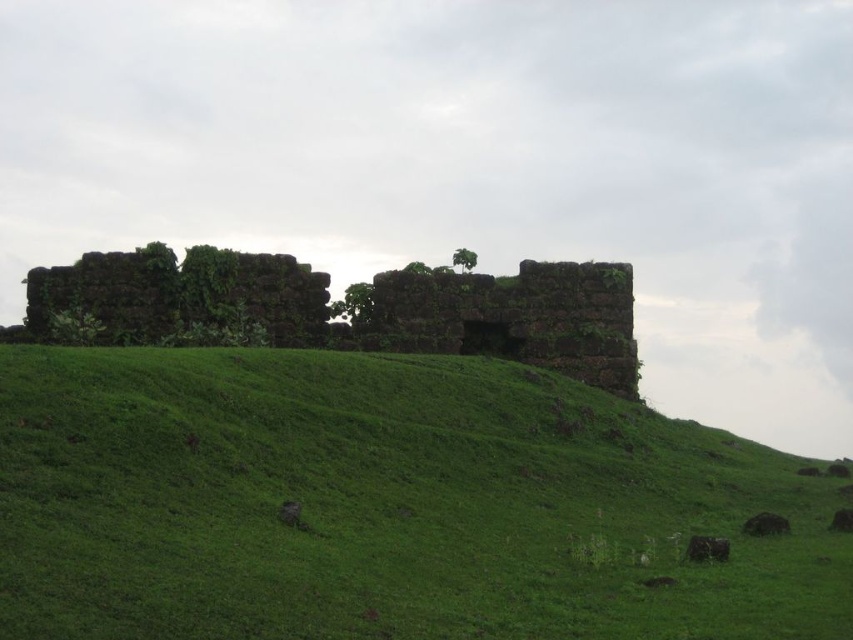
You are standing at the origin point of the coordinate system in the image. Which direction should you move to reach the green grassy hillside at center?

The green grassy hillside at center is located at coordinate point (386, 504), so you should move towards the direction of increasing x and y coordinates to reach it.

Looking at this image, you are standing at the point marked by the coordinates point (386, 504). Based on the scene description, what terrain feature are you currently standing on?

The point (386, 504) marks the green grassy hillside at center, so you are standing on the green grassy hillside at center.

Based on the photo, you are a hiker standing at the base of the green grassy hillside at center. You want to take a photo of the hillside from a distance of 50 meters. Can you move forward or backward to achieve this?

The green grassy hillside at center is currently 47.53 meters away. To reach a distance of 50 meters, you need to move backward by approximately 2.47 meters.